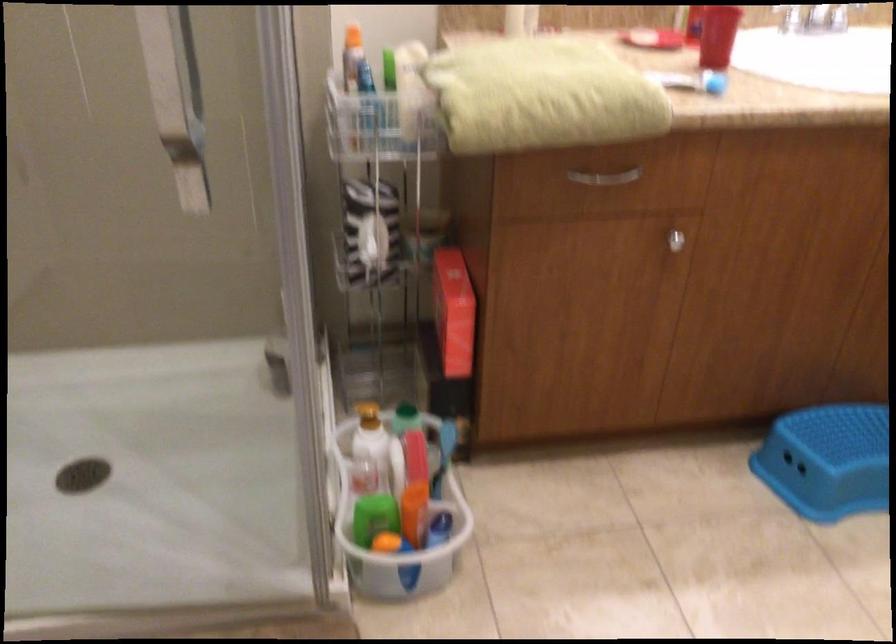
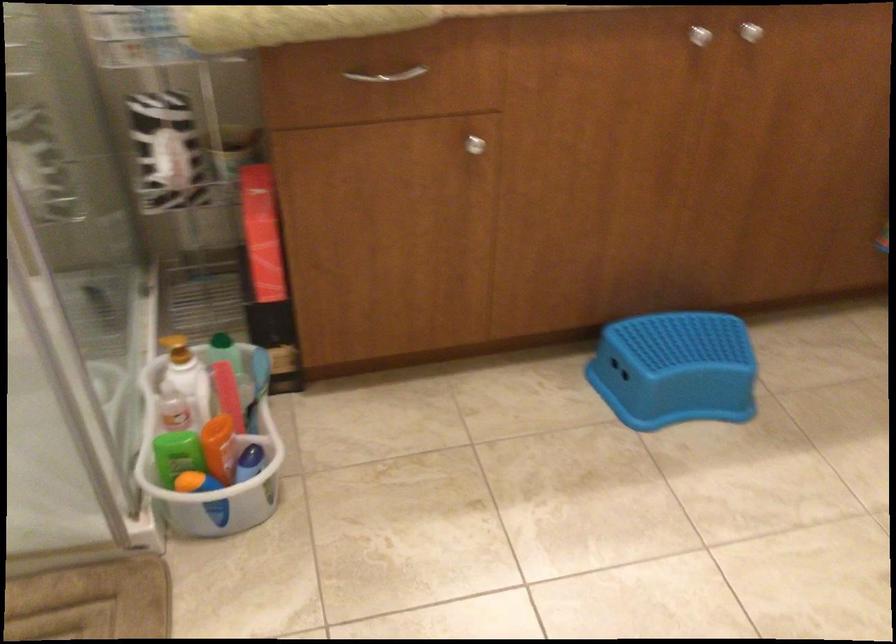
Locate, in the second image, the point that corresponds to the point at 457,337 in the first image.

(264, 263)